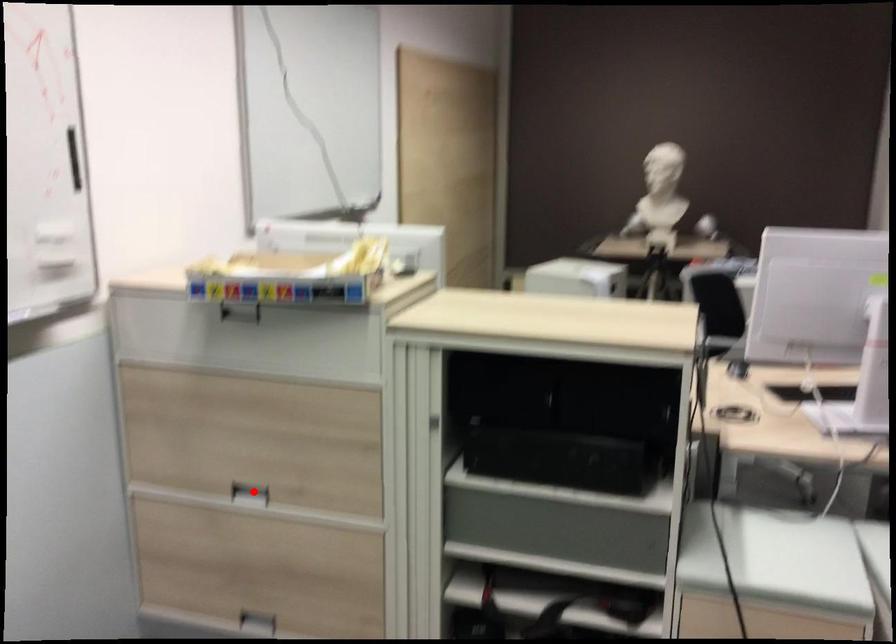
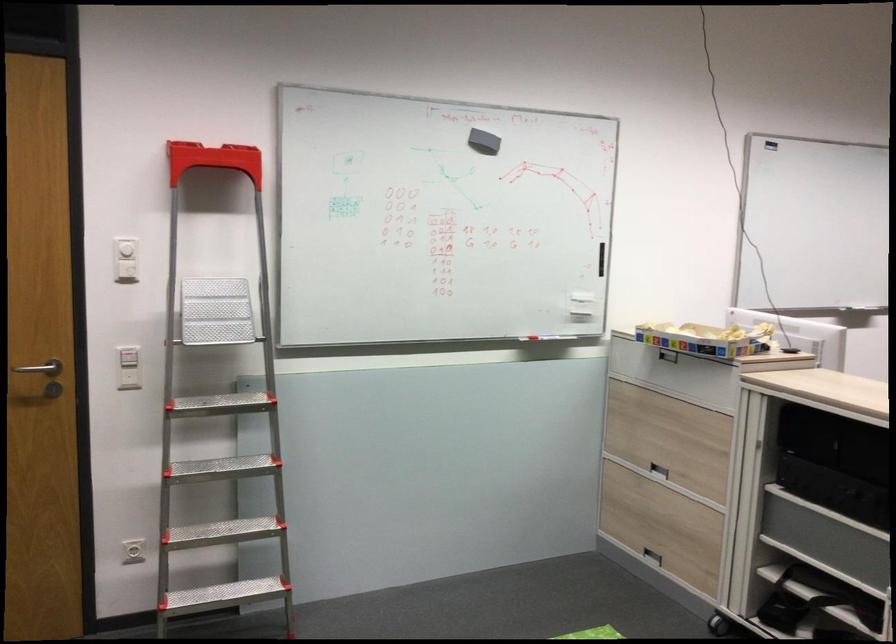
Question: I am providing you with two images of the same scene from different viewpoints. A red point is shown in image1. For the corresponding object point in image2, is it positioned nearer or farther from the camera?

Choices:
 (A) Nearer
 (B) Farther

Answer: (B)